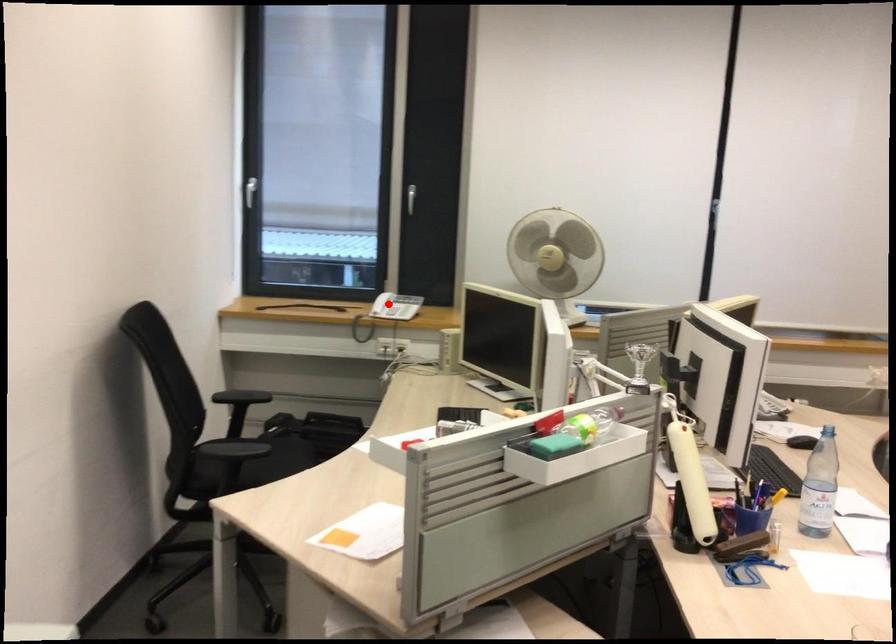
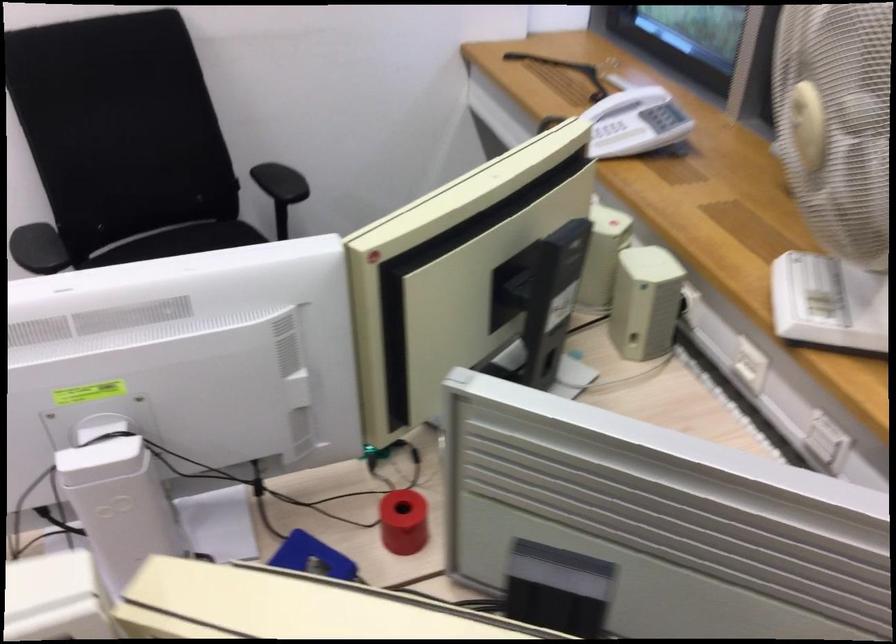
Find the pixel in the second image that matches the highlighted location in the first image.

(617, 138)